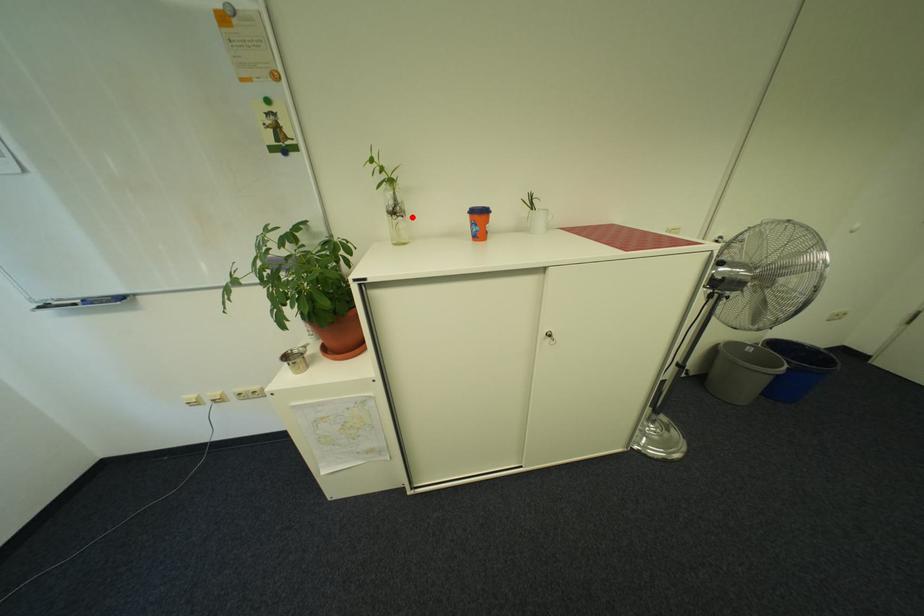
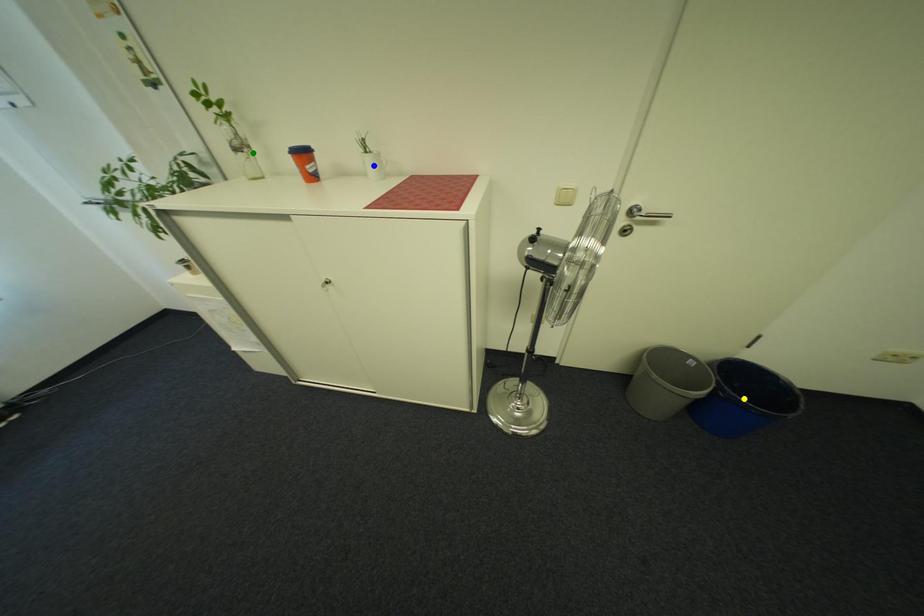
Question: I am providing you with two images of the same scene from different viewpoints. A red point is marked on the first image. You are given multiple points on the second image. Which spot in image 2 lines up with the point in image 1?

Choices:
 (A) yellow point
 (B) green point
 (C) blue point

Answer: (B)